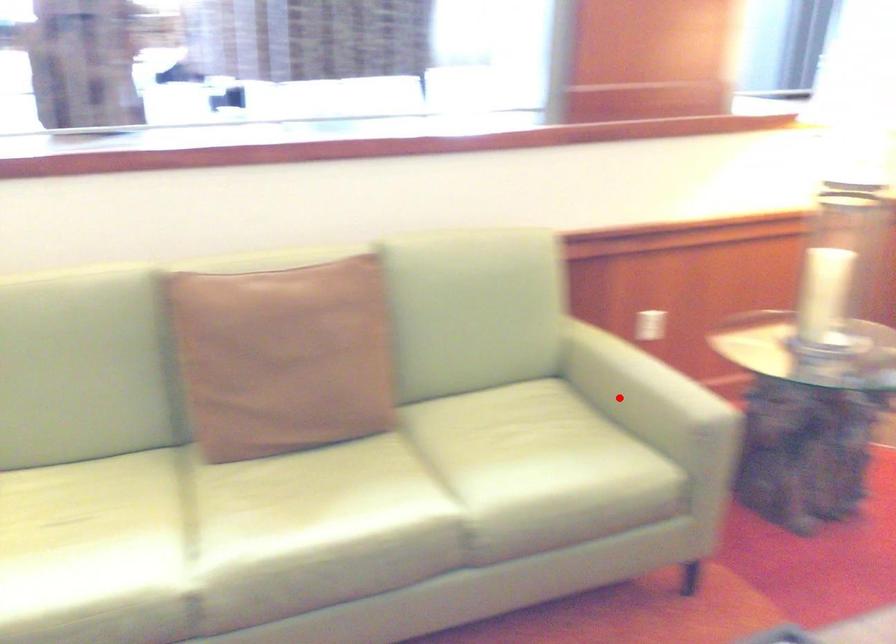
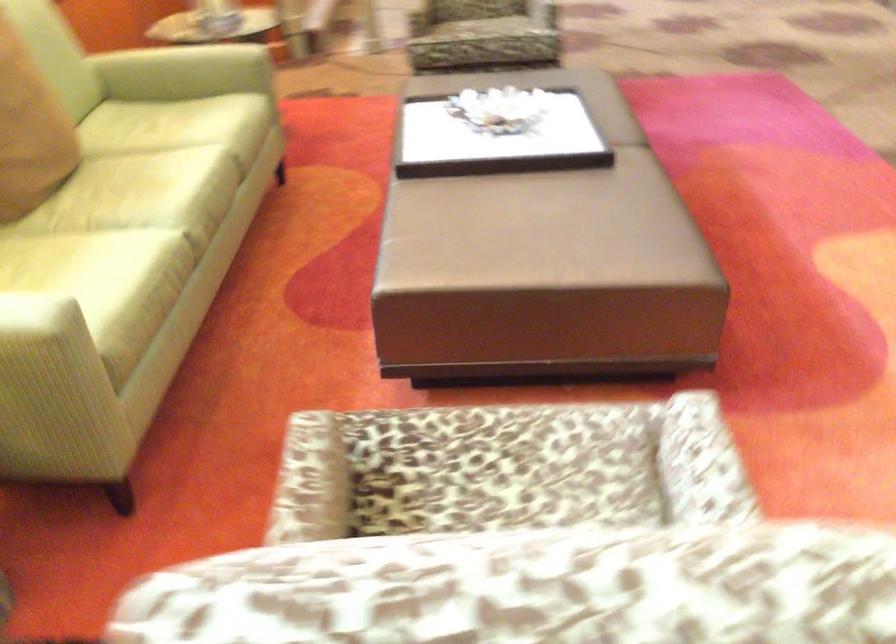
Question: I am providing you with two images of the same scene from different viewpoints. In image1, a red point is highlighted. Considering the same 3D point in image2, which of the following is correct?

Choices:
 (A) It is closer
 (B) It is farther

Answer: (B)